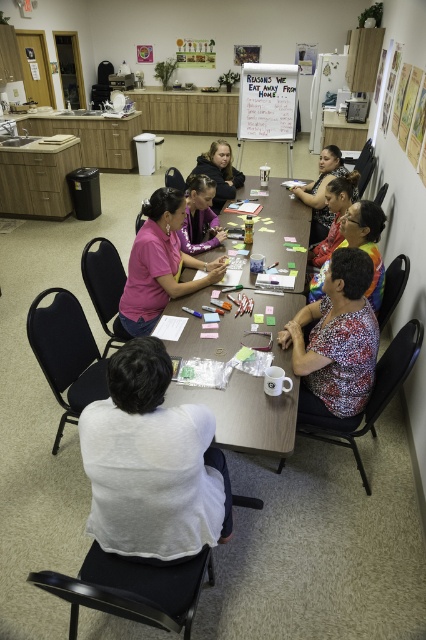
Find the location of a particular element. This screenshot has width=426, height=640. wooden table at center is located at coordinates (253, 392).

Locate an element on the screen. This screenshot has height=640, width=426. wooden table at center is located at coordinates (253, 392).

Can you confirm if wooden table at center is positioned above matte pink shirt at center?

Correct, wooden table at center is located above matte pink shirt at center.

Locate an element on the screen. wooden table at center is located at coordinates point(253,392).

Who is more forward, [259,384] or [152,257]?

Point [259,384] is more forward.

I want to click on wooden table at center, so click(x=253, y=392).

Measure the distance from purple fleece jacket at center to matte black hair at center.

They are 28.96 inches apart.

Which is in front, point (218, 237) or point (210, 173)?

Point (218, 237) is in front.

Locate an element on the screen. The image size is (426, 640). purple fleece jacket at center is located at coordinates tap(199, 216).